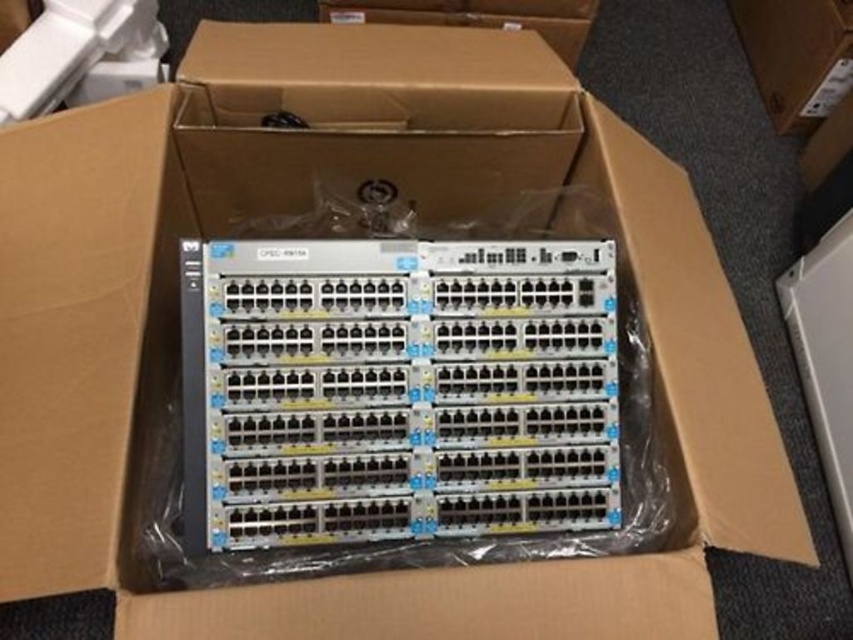
Is cardboard box at center positioned before brown cardboard box at upper center?

No, it is behind brown cardboard box at upper center.

Who is positioned more to the right, cardboard box at center or brown cardboard box at upper center?

cardboard box at center

Describe the element at coordinates (796, 56) in the screenshot. This screenshot has width=853, height=640. I see `cardboard box at center` at that location.

Locate an element on the screen. This screenshot has width=853, height=640. cardboard box at center is located at coordinates (796, 56).